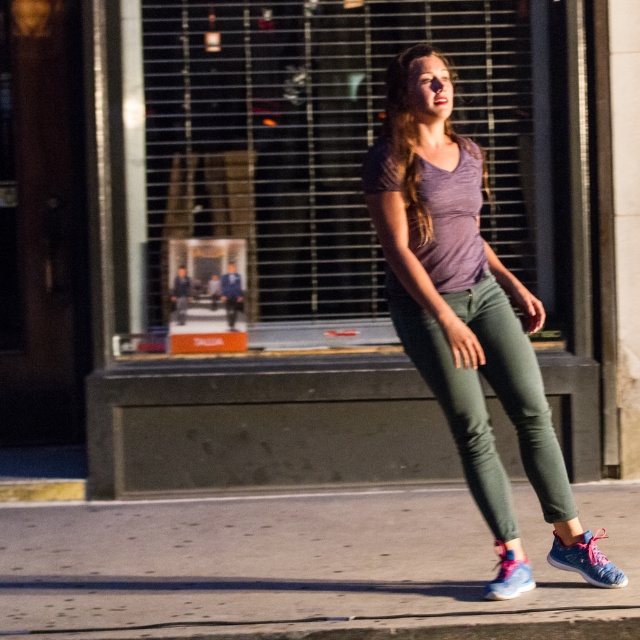
Can you confirm if smooth concrete pavement at center is positioned above pink mesh sneaker at lower right?

Incorrect, smooth concrete pavement at center is not positioned above pink mesh sneaker at lower right.

Is smooth concrete pavement at center to the right of pink mesh sneaker at lower right from the viewer's perspective?

In fact, smooth concrete pavement at center is to the left of pink mesh sneaker at lower right.

At what (x,y) coordinates should I click in order to perform the action: click on smooth concrete pavement at center. Please return your answer as a coordinate pair (x, y). The height and width of the screenshot is (640, 640). Looking at the image, I should click on (304, 566).

Identify the location of smooth concrete pavement at center. The width and height of the screenshot is (640, 640). (304, 566).

Consider the image. Which of these two, green denim leggings at center or pink mesh sneaker at lower right, stands taller?

green denim leggings at center

Who is shorter, green denim leggings at center or pink mesh sneaker at lower right?

pink mesh sneaker at lower right is shorter.

Between point (532, 404) and point (516, 579), which one is positioned in front?

Point (532, 404) is in front.

Find the location of a particular element. This screenshot has width=640, height=640. green denim leggings at center is located at coordinates click(484, 401).

Looking at this image, does matte glass shop window at center appear under purple matte shirt at center?

Actually, matte glass shop window at center is above purple matte shirt at center.

Which is more to the right, matte glass shop window at center or purple matte shirt at center?

→ purple matte shirt at center is more to the right.

Who is more forward, (552, 214) or (422, 344)?

Positioned in front is point (422, 344).

Find the location of a particular element. The image size is (640, 640). matte glass shop window at center is located at coordinates (332, 144).